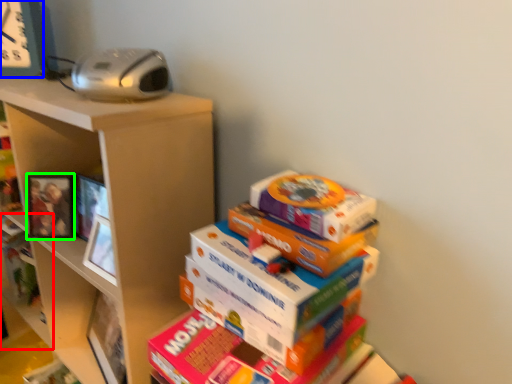
Question: Which object is positioned closest to shelf (highlighted by a red box)? Select from clock (highlighted by a blue box) and picture frame (highlighted by a green box).

Choices:
 (A) clock
 (B) picture frame

Answer: (B)